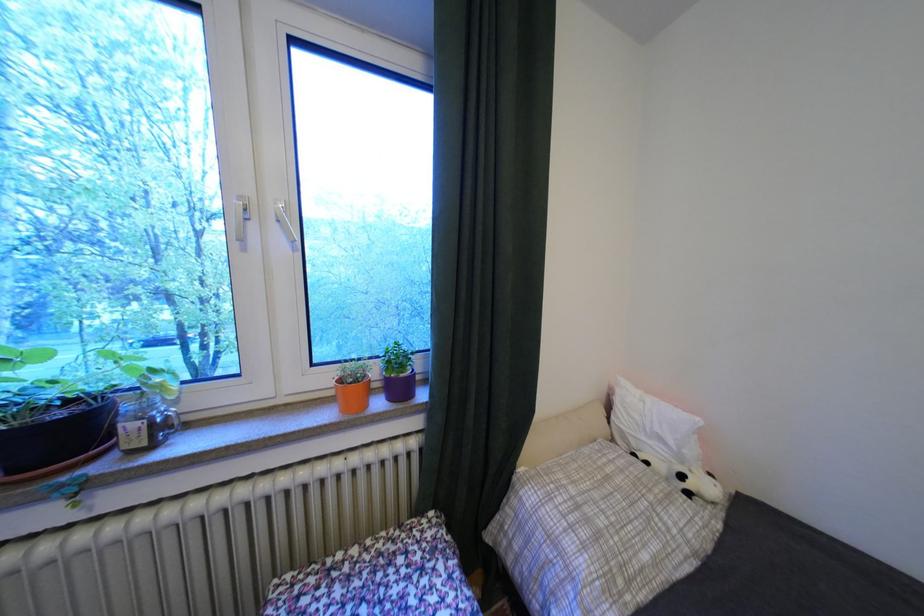
Find the location of `grey patterned pillow`. grey patterned pillow is located at coordinates (598, 533).